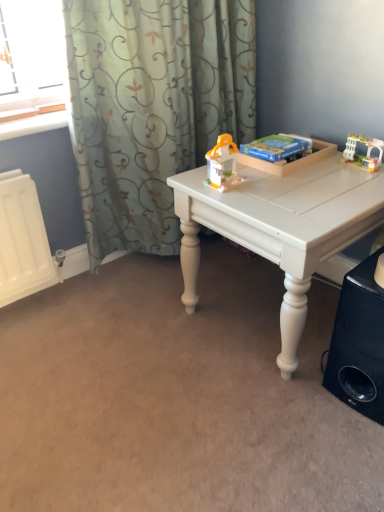
Where is `vacant space to the right of translucent plastic toy at center, which ranks as the first toy in left-to-right order`? This screenshot has width=384, height=512. vacant space to the right of translucent plastic toy at center, which ranks as the first toy in left-to-right order is located at coordinates (283, 189).